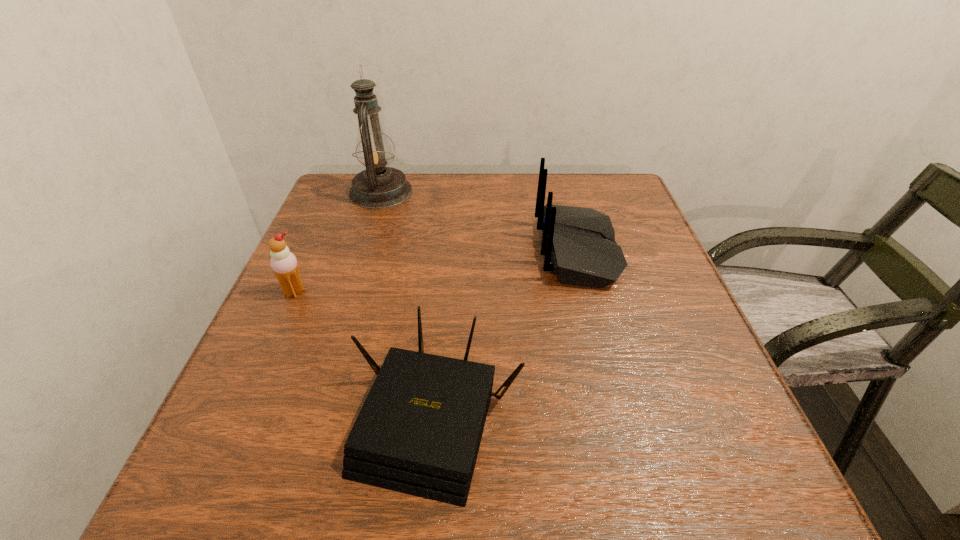
The height and width of the screenshot is (540, 960). What are the coordinates of `free region located 0.360m on the back of the taller router` in the screenshot? It's located at (380, 251).

At what (x,y) coordinates should I click in order to perform the action: click on blank space located 0.400m on the back of the taller router. Please return your answer as a coordinate pair (x, y). The height and width of the screenshot is (540, 960). Looking at the image, I should click on (362, 251).

Identify the location of vacant region located at the front with a straw on the icecream. (204, 495).

The image size is (960, 540). What are the coordinates of `vacant space positioned on the left of the shortest object` in the screenshot? It's located at (245, 418).

Where is `oil lamp at the far edge`? This screenshot has height=540, width=960. oil lamp at the far edge is located at coordinates (377, 187).

Locate an element on the screen. Image resolution: width=960 pixels, height=540 pixels. router that is at the far edge is located at coordinates (579, 245).

Locate an element on the screen. Image resolution: width=960 pixels, height=540 pixels. object present at the near edge is located at coordinates pyautogui.click(x=419, y=430).

Image resolution: width=960 pixels, height=540 pixels. Find the location of `oil lamp that is at the left edge`. oil lamp that is at the left edge is located at coordinates (377, 187).

Find the location of a particular element. This screenshot has width=960, height=540. icecream positioned at the left edge is located at coordinates (284, 264).

You are a GUI agent. You are given a task and a screenshot of the screen. Output one action in this format:
    pyautogui.click(x=<x>, y=<y>)
    Task: Click on the object that is at the right edge
    The height and width of the screenshot is (540, 960).
    Given the screenshot: What is the action you would take?
    pyautogui.click(x=579, y=245)